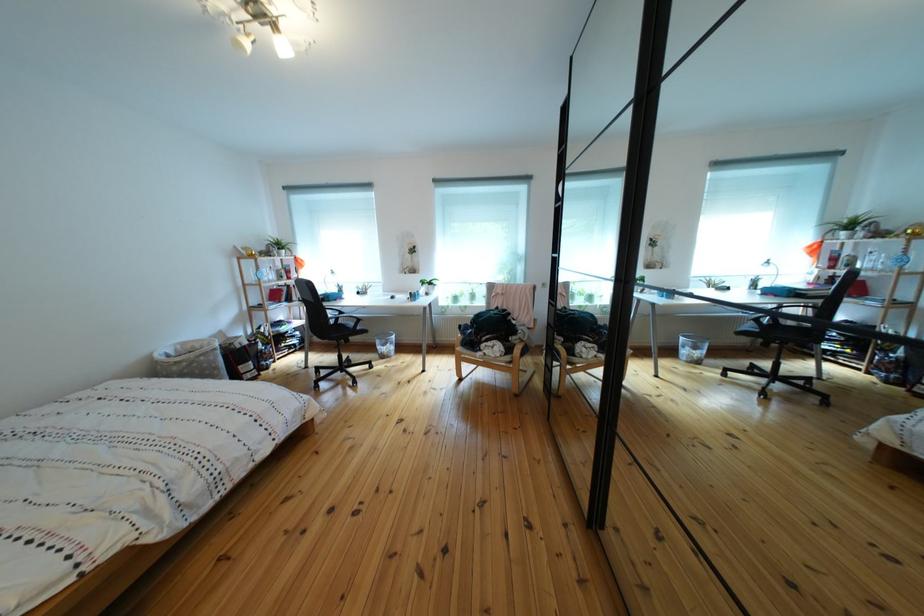
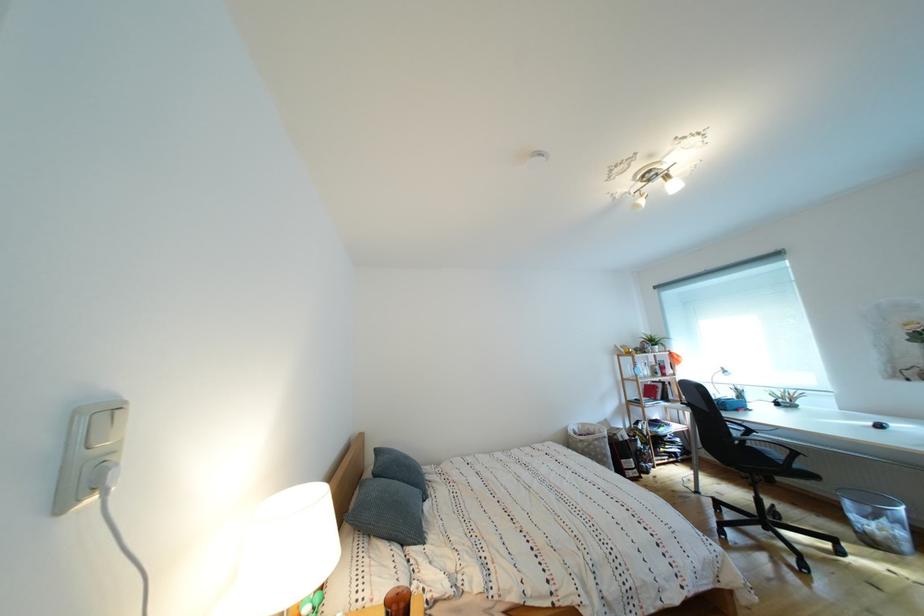
Find the pixel in the second image that matches (370,333) in the first image.

(808, 472)